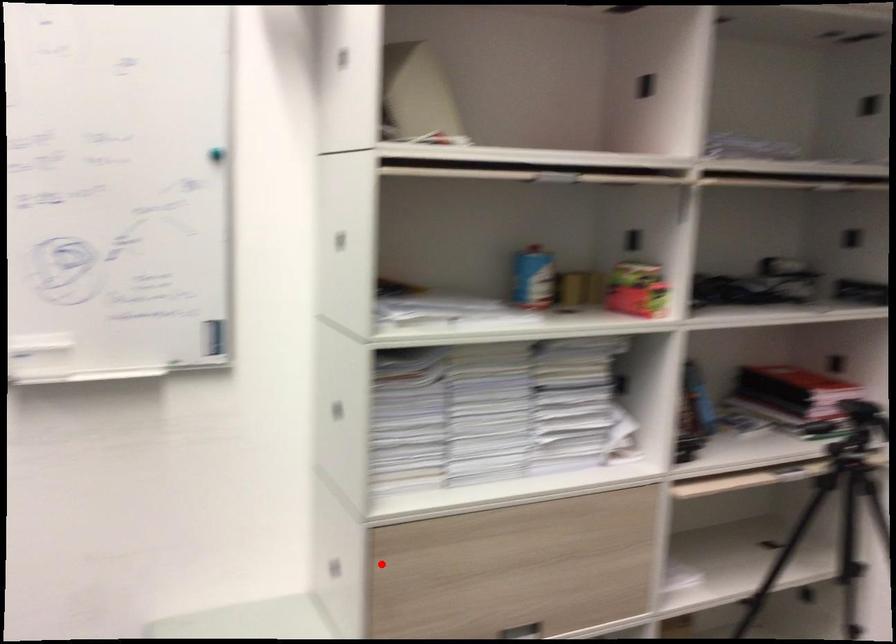
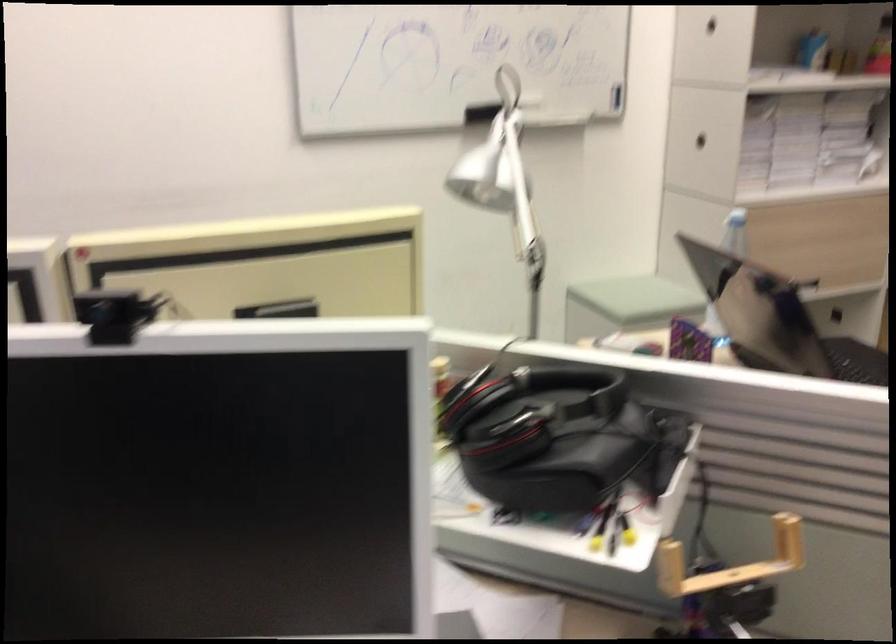
Locate, in the second image, the point that corresponds to the highlighted location in the first image.

(735, 232)